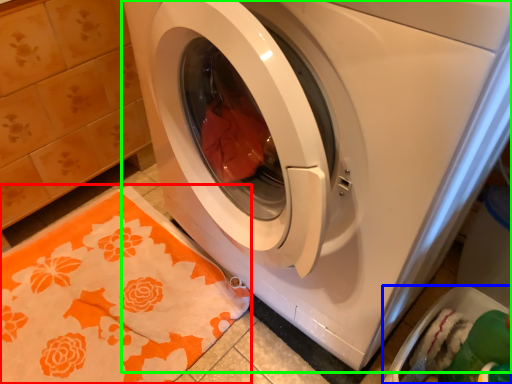
Question: Considering the real-world distances, which object is closest to blanket (highlighted by a red box)? dish washer (highlighted by a blue box) or washing machine (highlighted by a green box).

Choices:
 (A) dish washer
 (B) washing machine

Answer: (B)